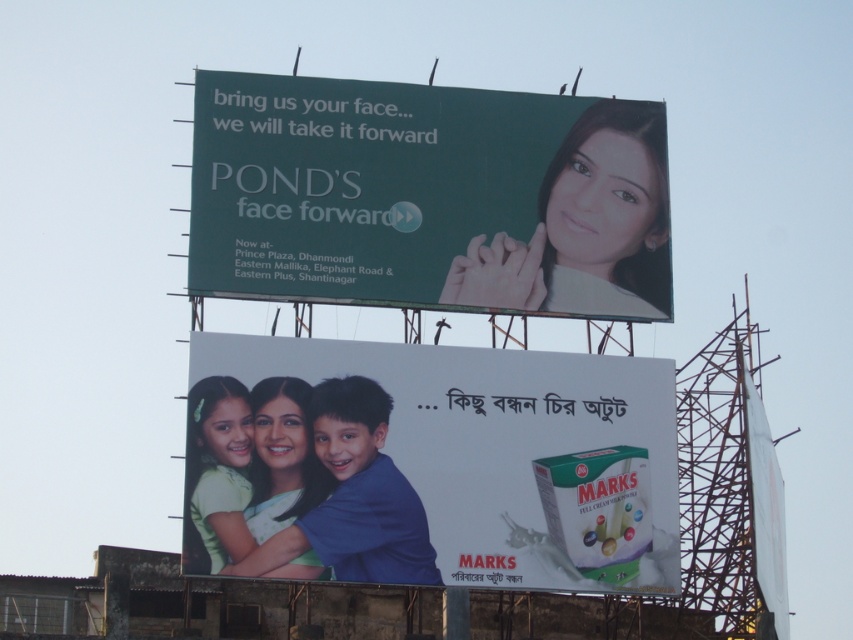
Question: Among these objects, which one is nearest to the camera?

Choices:
 (A) smooth skin face at upper right
 (B) white cardboard box at center
 (C) matte white face at center
 (D) green matte billboard at upper center

Answer: (B)

Question: Is green matte billboard at upper center smaller than smooth skin face at upper right?

Choices:
 (A) no
 (B) yes

Answer: (A)

Question: Does white cardboard box at center appear on the right side of smooth skin face at upper right?

Choices:
 (A) no
 (B) yes

Answer: (A)

Question: Which point is farther to the camera?

Choices:
 (A) (196, 170)
 (B) (635, 180)

Answer: (B)

Question: Among these points, which one is nearest to the camera?

Choices:
 (A) (281, 278)
 (B) (646, 390)

Answer: (A)

Question: Is green matte billboard at upper center above smooth skin face at upper right?

Choices:
 (A) no
 (B) yes

Answer: (B)